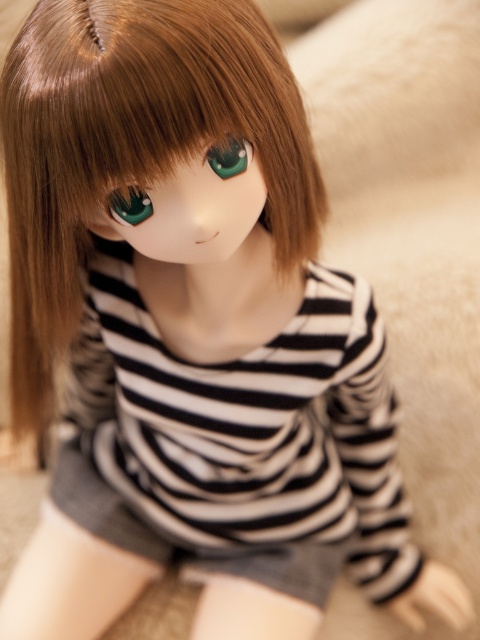
Is black striped shirt at center below green glossy eye at center?

Indeed, black striped shirt at center is positioned under green glossy eye at center.

Which is below, black striped shirt at center or green glossy eye at center?

black striped shirt at center

What do you see at coordinates (240, 440) in the screenshot? The image size is (480, 640). I see `black striped shirt at center` at bounding box center [240, 440].

Where is `black striped shirt at center`? Image resolution: width=480 pixels, height=640 pixels. black striped shirt at center is located at coordinates (240, 440).

Which is above, shiny brown hair at center or shiny green eye at center?

shiny green eye at center is above.

The height and width of the screenshot is (640, 480). I want to click on shiny brown hair at center, so click(x=132, y=144).

This screenshot has width=480, height=640. Find the location of `shiny brown hair at center`. shiny brown hair at center is located at coordinates (132, 144).

Does point (211, 157) come closer to viewer compared to point (131, 225)?

Yes, point (211, 157) is closer to viewer.

Between point (225, 161) and point (134, 225), which one is positioned in front?

Point (225, 161) is in front.

Identify the location of green glossy eye at center. The width and height of the screenshot is (480, 640). (229, 157).